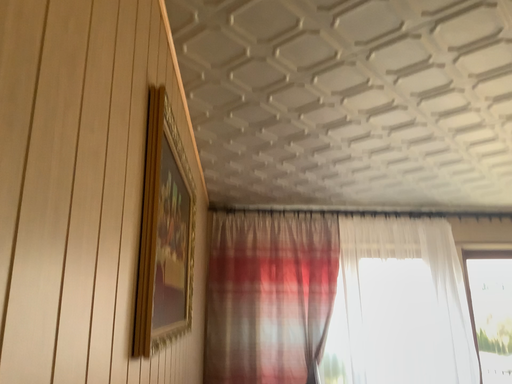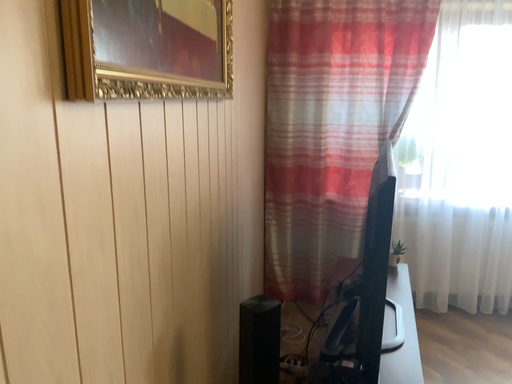
Question: Which way did the camera rotate in the video?

Choices:
 (A) rotated upward
 (B) rotated downward

Answer: (B)